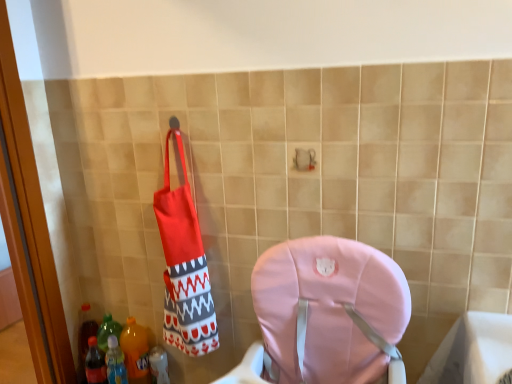
What do you see at coordinates (159, 365) in the screenshot? I see `translucent plastic bottle at lower left, which is the 3th bottle from left to right` at bounding box center [159, 365].

How much space does translucent plastic bottle at lower left, which is the 3th bottle from left to right, occupy horizontally?

The width of translucent plastic bottle at lower left, which is the 3th bottle from left to right, is 3.37 inches.

I want to click on translucent plastic bottle at lower left, which is counted as the third bottle, starting from the right, so click(115, 362).

Are translucent plastic bottle at lower left, which is the second bottle in left-to-right order, and translucent plastic bottle at lower left, which is the 3th bottle from left to right, far apart?

No, there isn't a large distance between translucent plastic bottle at lower left, which is the second bottle in left-to-right order, and translucent plastic bottle at lower left, which is the 3th bottle from left to right.

Looking at this image, from the image's perspective, would you say translucent plastic bottle at lower left, acting as the 2th bottle starting from the right, is positioned over translucent plastic bottle at lower left, the 1th bottle from the right?

Yes.

Does translucent plastic bottle at lower left, acting as the 2th bottle starting from the right, appear on the left side of translucent plastic bottle at lower left, the 1th bottle from the right?

Correct, you'll find translucent plastic bottle at lower left, acting as the 2th bottle starting from the right, to the left of translucent plastic bottle at lower left, the 1th bottle from the right.

Is translucent plastic bottle at lower left, the first bottle positioned from the left, surrounding translucent plastic bottle at lower left, acting as the 2th bottle starting from the right?

That's incorrect, translucent plastic bottle at lower left, acting as the 2th bottle starting from the right, is not inside translucent plastic bottle at lower left, the first bottle positioned from the left.

From the image's perspective, which is below, translucent plastic bottle at lower left, which is counted as the third bottle, starting from the right, or translucent plastic bottle at lower left, which is the second bottle in left-to-right order?

translucent plastic bottle at lower left, which is counted as the third bottle, starting from the right, is shown below in the image.

Considering the relative positions of translucent plastic bottle at lower left, which is counted as the third bottle, starting from the right, and translucent plastic bottle at lower left, which is the second bottle in left-to-right order, in the image provided, is translucent plastic bottle at lower left, which is counted as the third bottle, starting from the right, in front of translucent plastic bottle at lower left, which is the second bottle in left-to-right order,?

Yes, the depth of translucent plastic bottle at lower left, which is counted as the third bottle, starting from the right, is less than that of translucent plastic bottle at lower left, which is the second bottle in left-to-right order.

From the picture: Considering the relative sizes of translucent plastic bottle at lower left, the 1th bottle from the right, and translucent plastic bottle at lower left, which is counted as the third bottle, starting from the right, in the image provided, is translucent plastic bottle at lower left, the 1th bottle from the right, smaller than translucent plastic bottle at lower left, which is counted as the third bottle, starting from the right,?

Yes, translucent plastic bottle at lower left, the 1th bottle from the right, is smaller than translucent plastic bottle at lower left, which is counted as the third bottle, starting from the right.

The height and width of the screenshot is (384, 512). In order to click on bottle lying below the translucent plastic bottle at lower left, which is counted as the third bottle, starting from the right (from the image's perspective) in this screenshot , I will do `click(159, 365)`.

Is translucent plastic bottle at lower left, which is the 3th bottle from left to right, facing towards translucent plastic bottle at lower left, which is counted as the third bottle, starting from the right?

No.

From the image's perspective, which is above, translucent plastic bottle at lower left, which is the second bottle in left-to-right order, or translucent plastic bottle at lower left, the first bottle positioned from the left?

From the image's view, translucent plastic bottle at lower left, which is the second bottle in left-to-right order, is above.

From a real-world perspective, which is physically above, translucent plastic bottle at lower left, acting as the 2th bottle starting from the right, or translucent plastic bottle at lower left, which is counted as the third bottle, starting from the right?

translucent plastic bottle at lower left, acting as the 2th bottle starting from the right.

From the picture: Is translucent plastic bottle at lower left, acting as the 2th bottle starting from the right, positioned with its back to translucent plastic bottle at lower left, which is counted as the third bottle, starting from the right?

Yes, translucent plastic bottle at lower left, which is counted as the third bottle, starting from the right, is at the back of translucent plastic bottle at lower left, acting as the 2th bottle starting from the right.

Which is correct: translucent plastic bottle at lower left, which is counted as the third bottle, starting from the right, is inside translucent plastic bottle at lower left, the 1th bottle from the right, or outside of it?

translucent plastic bottle at lower left, which is counted as the third bottle, starting from the right, exists outside the volume of translucent plastic bottle at lower left, the 1th bottle from the right.

Based on the photo, can you tell me how much translucent plastic bottle at lower left, the first bottle positioned from the left, and translucent plastic bottle at lower left, the 1th bottle from the right, differ in facing direction?

0.00249 degrees separate the facing orientations of translucent plastic bottle at lower left, the first bottle positioned from the left, and translucent plastic bottle at lower left, the 1th bottle from the right.

In terms of height, does translucent plastic bottle at lower left, the first bottle positioned from the left, look taller or shorter compared to translucent plastic bottle at lower left, the 1th bottle from the right?

Clearly, translucent plastic bottle at lower left, the first bottle positioned from the left, is taller compared to translucent plastic bottle at lower left, the 1th bottle from the right.

In order to click on the 2nd bottle counting from the left of the translucent plastic bottle at lower left, the 1th bottle from the right in this screenshot , I will do `click(115, 362)`.

Considering the relative sizes of translucent plastic bottle at lower left, which is the 3th bottle from left to right, and translucent plastic bottle at lower left, acting as the 2th bottle starting from the right, in the image provided, is translucent plastic bottle at lower left, which is the 3th bottle from left to right, thinner than translucent plastic bottle at lower left, acting as the 2th bottle starting from the right,?

Indeed, translucent plastic bottle at lower left, which is the 3th bottle from left to right, has a lesser width compared to translucent plastic bottle at lower left, acting as the 2th bottle starting from the right.

Looking at this image, is translucent plastic bottle at lower left, the 1th bottle from the right, completely or partially outside of translucent plastic bottle at lower left, acting as the 2th bottle starting from the right?

That's correct, translucent plastic bottle at lower left, the 1th bottle from the right, is outside of translucent plastic bottle at lower left, acting as the 2th bottle starting from the right.

Based on their sizes in the image, would you say translucent plastic bottle at lower left, which is the 3th bottle from left to right, is bigger or smaller than translucent plastic bottle at lower left, acting as the 2th bottle starting from the right?

translucent plastic bottle at lower left, which is the 3th bottle from left to right, is smaller than translucent plastic bottle at lower left, acting as the 2th bottle starting from the right.

Where is `the 2nd bottle directly above the translucent plastic bottle at lower left, the 1th bottle from the right (from a real-world perspective)`? the 2nd bottle directly above the translucent plastic bottle at lower left, the 1th bottle from the right (from a real-world perspective) is located at coordinates (135, 352).

Where is `the 1st bottle positioned below the translucent plastic bottle at lower left, acting as the 2th bottle starting from the right (from the image's perspective)`? This screenshot has height=384, width=512. the 1st bottle positioned below the translucent plastic bottle at lower left, acting as the 2th bottle starting from the right (from the image's perspective) is located at coordinates (115, 362).

From the image, which object appears to be nearer to translucent plastic bottle at lower left, which is the second bottle in left-to-right order, translucent plastic bottle at lower left, the first bottle positioned from the left, or translucent plastic bottle at lower left, the 1th bottle from the right?

translucent plastic bottle at lower left, the first bottle positioned from the left.

Looking at the image, which one is located closer to translucent plastic bottle at lower left, the first bottle positioned from the left, translucent plastic bottle at lower left, which is the second bottle in left-to-right order, or translucent plastic bottle at lower left, the 1th bottle from the right?

The object closer to translucent plastic bottle at lower left, the first bottle positioned from the left, is translucent plastic bottle at lower left, which is the second bottle in left-to-right order.

Based on their spatial positions, is translucent plastic bottle at lower left, acting as the 2th bottle starting from the right, or translucent plastic bottle at lower left, which is counted as the third bottle, starting from the right, closer to translucent plastic bottle at lower left, which is the 3th bottle from left to right?

translucent plastic bottle at lower left, acting as the 2th bottle starting from the right.

Estimate the real-world distances between objects in this image. Which object is closer to translucent plastic bottle at lower left, which is counted as the third bottle, starting from the right, translucent plastic bottle at lower left, the 1th bottle from the right, or translucent plastic bottle at lower left, acting as the 2th bottle starting from the right?

The object closer to translucent plastic bottle at lower left, which is counted as the third bottle, starting from the right, is translucent plastic bottle at lower left, acting as the 2th bottle starting from the right.

Looking at the image, which one is located further to translucent plastic bottle at lower left, acting as the 2th bottle starting from the right, translucent plastic bottle at lower left, which is the 3th bottle from left to right, or translucent plastic bottle at lower left, which is counted as the third bottle, starting from the right?

The object further to translucent plastic bottle at lower left, acting as the 2th bottle starting from the right, is translucent plastic bottle at lower left, which is the 3th bottle from left to right.

Estimate the real-world distances between objects in this image. Which object is further from translucent plastic bottle at lower left, which is the 3th bottle from left to right, translucent plastic bottle at lower left, which is counted as the third bottle, starting from the right, or translucent plastic bottle at lower left, which is the second bottle in left-to-right order?

translucent plastic bottle at lower left, which is counted as the third bottle, starting from the right, is further to translucent plastic bottle at lower left, which is the 3th bottle from left to right.

Where is `bottle between translucent plastic bottle at lower left, which is counted as the third bottle, starting from the right, and translucent plastic bottle at lower left, the 1th bottle from the right`? The width and height of the screenshot is (512, 384). bottle between translucent plastic bottle at lower left, which is counted as the third bottle, starting from the right, and translucent plastic bottle at lower left, the 1th bottle from the right is located at coordinates click(x=135, y=352).